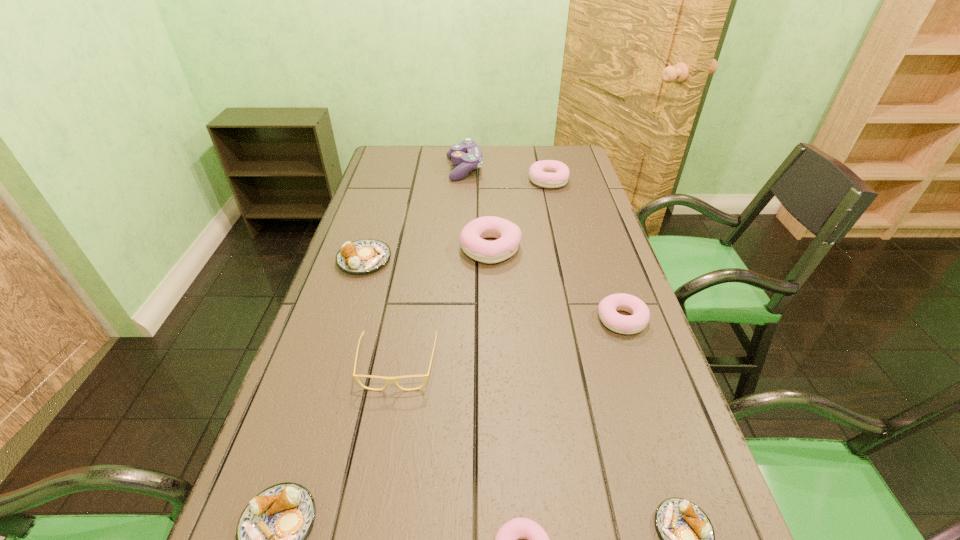
I want to click on spectacles that is at the left edge, so click(x=386, y=379).

At what (x,y) coordinates should I click in order to perform the action: click on object present at the far right corner. Please return your answer as a coordinate pair (x, y). Image resolution: width=960 pixels, height=540 pixels. Looking at the image, I should click on (547, 173).

Locate an element on the screen. The width and height of the screenshot is (960, 540). free space at the far edge of the desktop is located at coordinates (507, 171).

Locate an element on the screen. The height and width of the screenshot is (540, 960). vacant space at the left edge of the desktop is located at coordinates (369, 285).

The width and height of the screenshot is (960, 540). I want to click on free space at the right edge of the desktop, so click(618, 288).

The height and width of the screenshot is (540, 960). I want to click on free space at the far left corner of the desktop, so click(x=404, y=151).

Identify the location of vacant region between the fourth nearest pastry and the tallest object. The width and height of the screenshot is (960, 540). (542, 245).

Image resolution: width=960 pixels, height=540 pixels. I want to click on object that is the second closest to the fourth farthest pastry, so click(x=688, y=539).

Identify the location of object identified as the fourth closest to the second biggest brown pastry. (366, 255).

Identify which pastry is the fifth closest to the nearest pink pastry. Please provide its 2D coordinates. Your answer should be formatted as a tuple, i.e. [(x, y)], where the tuple contains the x and y coordinates of a point satisfying the conditions above.

[(366, 255)]